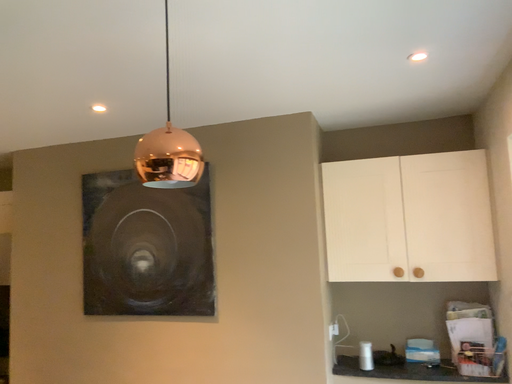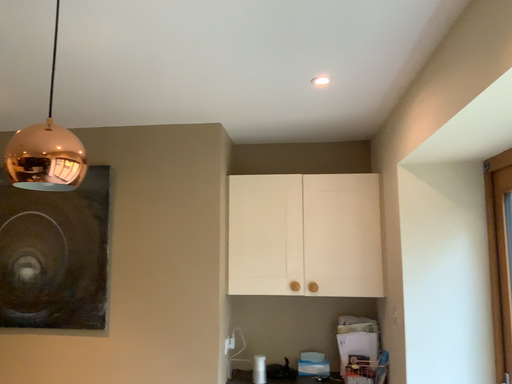
Question: How did the camera likely rotate when shooting the video?

Choices:
 (A) rotated right
 (B) rotated left

Answer: (A)